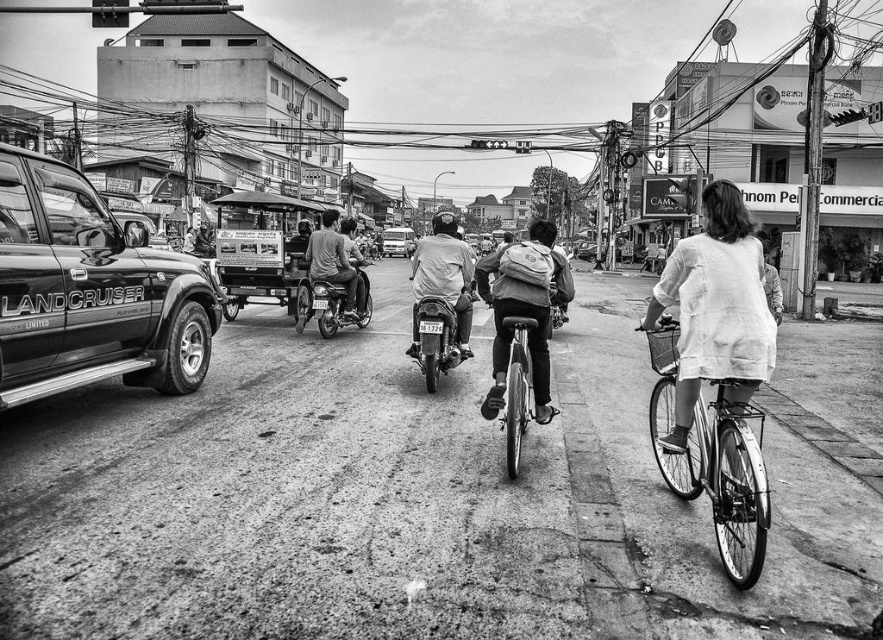
You are a delivery person who needs to quickly reach a nearby delivery point. You see a metallic silver bicycle at center and a metallic silver motorbike at center. Which vehicle would allow you to reach the destination faster if you choose to ride it?

The metallic silver motorbike at center would allow you to reach the destination faster because motorbikes generally have higher speeds than bicycles.

You are a pedestrian standing on the sidewalk and see both the metallic silver bicycle at center and the metallic silver motorbike at center. Which one is nearer to you?

The metallic silver bicycle at center is closer to the viewer than the metallic silver motorbike at center.